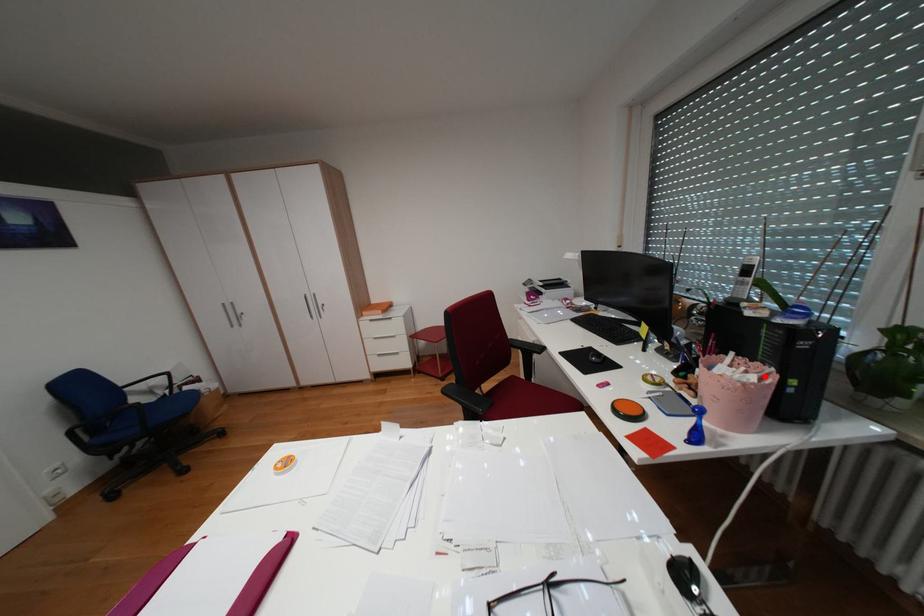
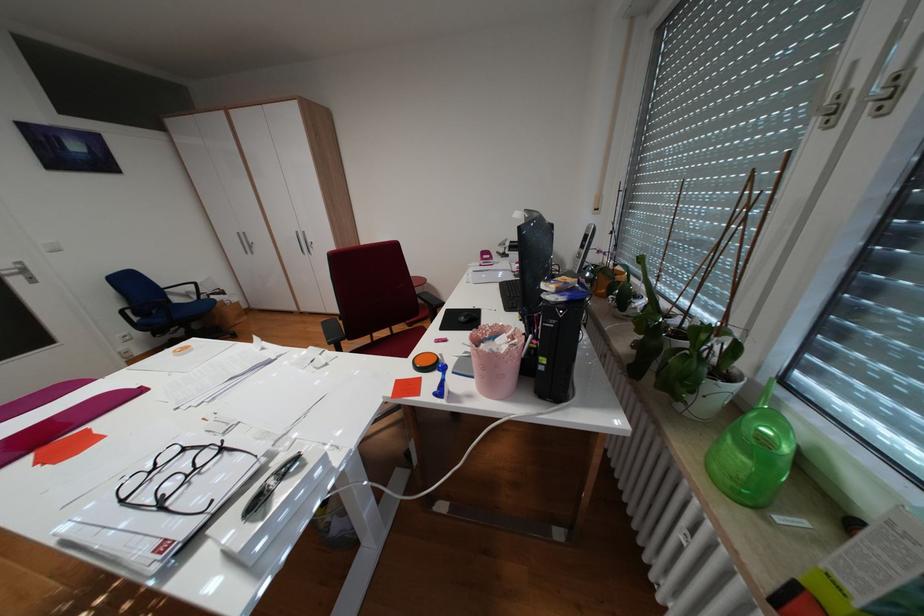
The point at the highlighted location is marked in the first image. Where is the corresponding point in the second image?

(517, 347)